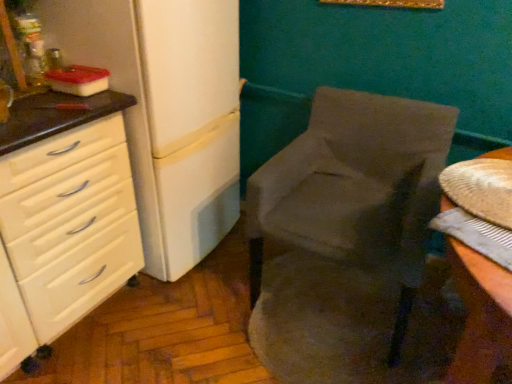
Question: Does white matte refrigerator at left appear on the right side of white glossy chest of drawers at left?

Choices:
 (A) yes
 (B) no

Answer: (A)

Question: Does white matte refrigerator at left have a smaller size compared to white glossy chest of drawers at left?

Choices:
 (A) yes
 (B) no

Answer: (B)

Question: Is white matte refrigerator at left with white glossy chest of drawers at left?

Choices:
 (A) no
 (B) yes

Answer: (A)

Question: Is white matte refrigerator at left behind white glossy chest of drawers at left?

Choices:
 (A) no
 (B) yes

Answer: (B)

Question: From a real-world perspective, is white matte refrigerator at left located higher than white glossy chest of drawers at left?

Choices:
 (A) no
 (B) yes

Answer: (B)

Question: Is white glossy chest of drawers at left located within white matte refrigerator at left?

Choices:
 (A) no
 (B) yes

Answer: (A)

Question: Considering the relative positions of white glossy chest of drawers at left and velvet gray chair at center in the image provided, is white glossy chest of drawers at left to the left of velvet gray chair at center from the viewer's perspective?

Choices:
 (A) yes
 (B) no

Answer: (A)

Question: From the image's perspective, would you say white glossy chest of drawers at left is positioned over velvet gray chair at center?

Choices:
 (A) yes
 (B) no

Answer: (B)

Question: Is white glossy chest of drawers at left far away from velvet gray chair at center?

Choices:
 (A) no
 (B) yes

Answer: (A)

Question: Is white glossy chest of drawers at left oriented away from velvet gray chair at center?

Choices:
 (A) yes
 (B) no

Answer: (B)

Question: From the image's perspective, is white glossy chest of drawers at left below velvet gray chair at center?

Choices:
 (A) no
 (B) yes

Answer: (B)

Question: From a real-world perspective, is white glossy chest of drawers at left positioned over velvet gray chair at center based on gravity?

Choices:
 (A) yes
 (B) no

Answer: (A)

Question: From the image's perspective, is white matte refrigerator at left on top of velvet gray chair at center?

Choices:
 (A) no
 (B) yes

Answer: (B)